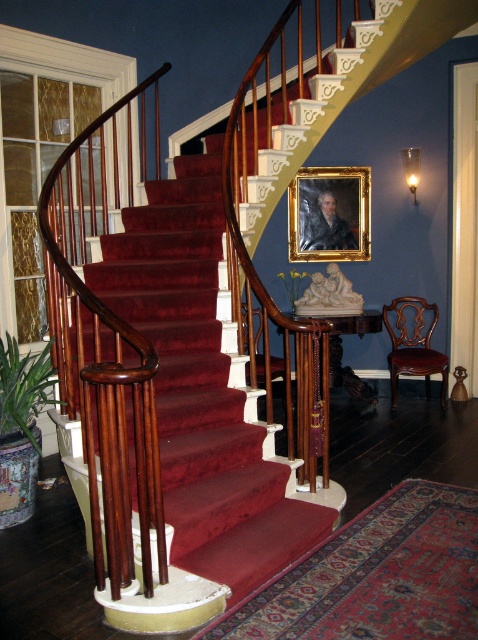
Does mahogany wood stairs at center appear under mahogany wood railing at left?

No.

Does point (176, 291) come behind point (39, 221)?

That is True.

Describe the element at coordinates (231, 352) in the screenshot. The width and height of the screenshot is (478, 640). I see `mahogany wood stairs at center` at that location.

The image size is (478, 640). I want to click on mahogany wood stairs at center, so click(x=231, y=352).

Can you confirm if mahogany wood stairs at center is thinner than goldwooden frame at center?

In fact, mahogany wood stairs at center might be wider than goldwooden frame at center.

Where is `mahogany wood stairs at center`? The width and height of the screenshot is (478, 640). mahogany wood stairs at center is located at coordinates (231, 352).

At what (x,y) coordinates should I click in order to perform the action: click on mahogany wood stairs at center. Please return your answer as a coordinate pair (x, y). Image resolution: width=478 pixels, height=640 pixels. Looking at the image, I should click on (231, 352).

Is point (116, 474) in front of point (293, 212)?

Yes.

Which is in front, point (113, 182) or point (317, 205)?

Point (113, 182) is in front.

This screenshot has width=478, height=640. Find the location of `mahogany wood railing at left`. mahogany wood railing at left is located at coordinates (106, 340).